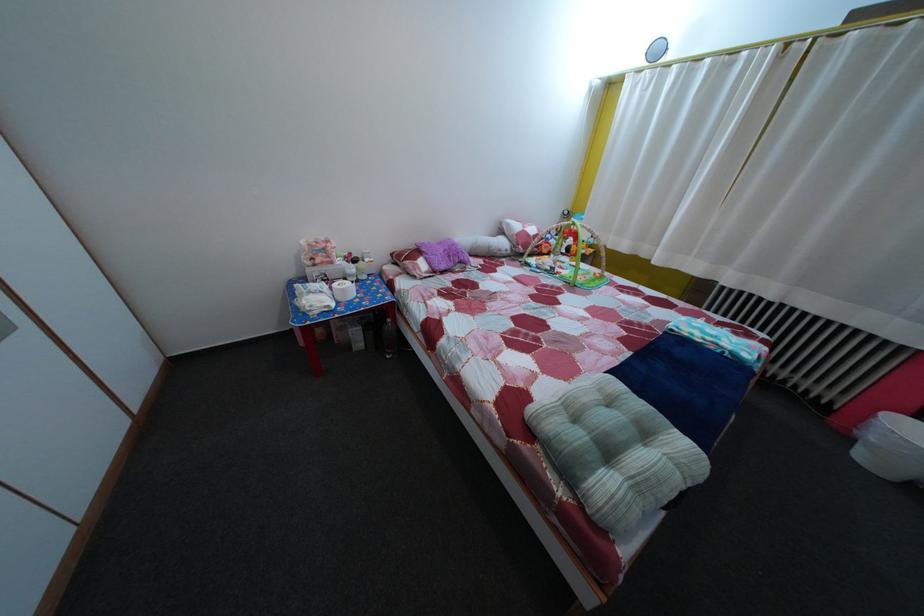
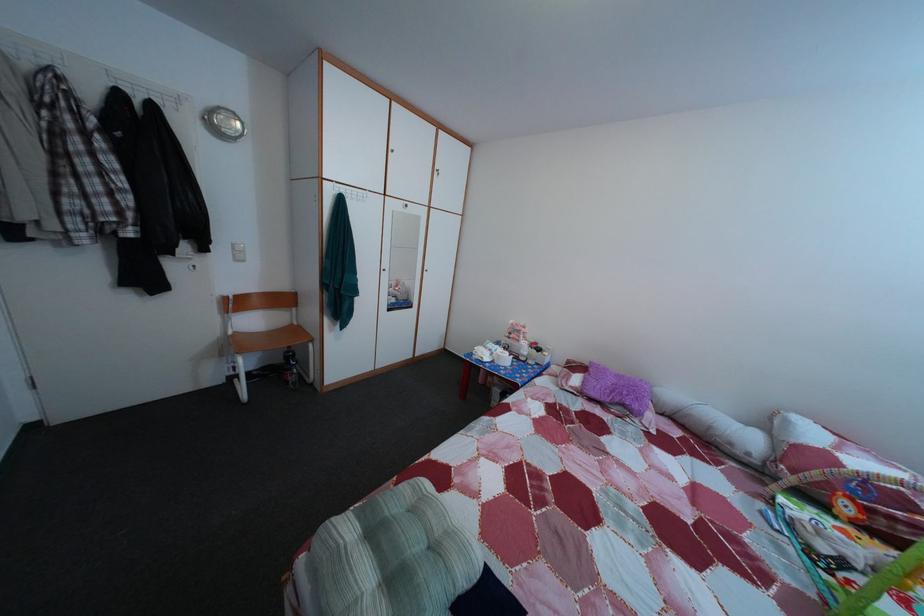
Locate, in the second image, the point that corresponds to the point at 342,270 in the first image.

(528, 349)